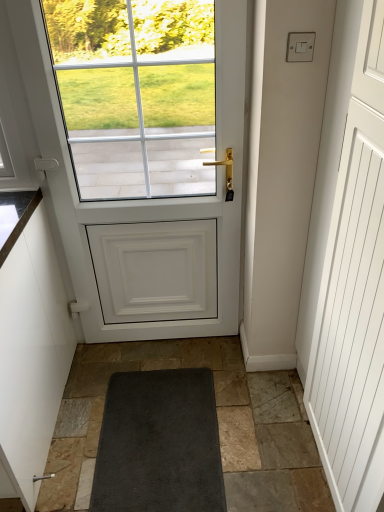
Question: From a real-world perspective, is white matte door at center positioned under white matte screen door at right based on gravity?

Choices:
 (A) no
 (B) yes

Answer: (A)

Question: Is white matte door at center outside of white matte screen door at right?

Choices:
 (A) no
 (B) yes

Answer: (B)

Question: Are white matte door at center and white matte screen door at right located far from each other?

Choices:
 (A) no
 (B) yes

Answer: (A)

Question: Is the depth of white matte door at center less than that of white matte screen door at right?

Choices:
 (A) yes
 (B) no

Answer: (B)

Question: From a real-world perspective, is white matte door at center located higher than white matte screen door at right?

Choices:
 (A) yes
 (B) no

Answer: (A)

Question: From the image's perspective, would you say white matte door at center is positioned over white matte screen door at right?

Choices:
 (A) no
 (B) yes

Answer: (B)

Question: Does white matte cabinet at left have a lesser width compared to white matte screen door at right?

Choices:
 (A) yes
 (B) no

Answer: (B)

Question: From a real-world perspective, is white matte cabinet at left located beneath white matte screen door at right?

Choices:
 (A) yes
 (B) no

Answer: (A)

Question: Is white matte cabinet at left surrounding white matte screen door at right?

Choices:
 (A) yes
 (B) no

Answer: (B)

Question: Is white matte cabinet at left taller than white matte screen door at right?

Choices:
 (A) yes
 (B) no

Answer: (B)

Question: Are white matte cabinet at left and white matte screen door at right far apart?

Choices:
 (A) yes
 (B) no

Answer: (A)

Question: From a real-world perspective, is white matte cabinet at left physically above white matte screen door at right?

Choices:
 (A) yes
 (B) no

Answer: (B)

Question: Can you confirm if white matte cabinet at left is positioned to the right of white matte door at center?

Choices:
 (A) no
 (B) yes

Answer: (A)